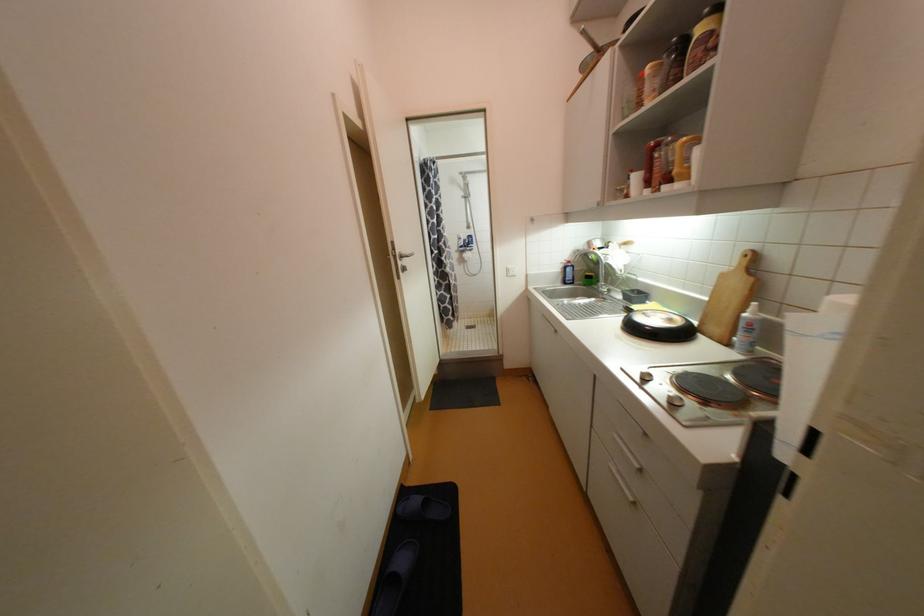
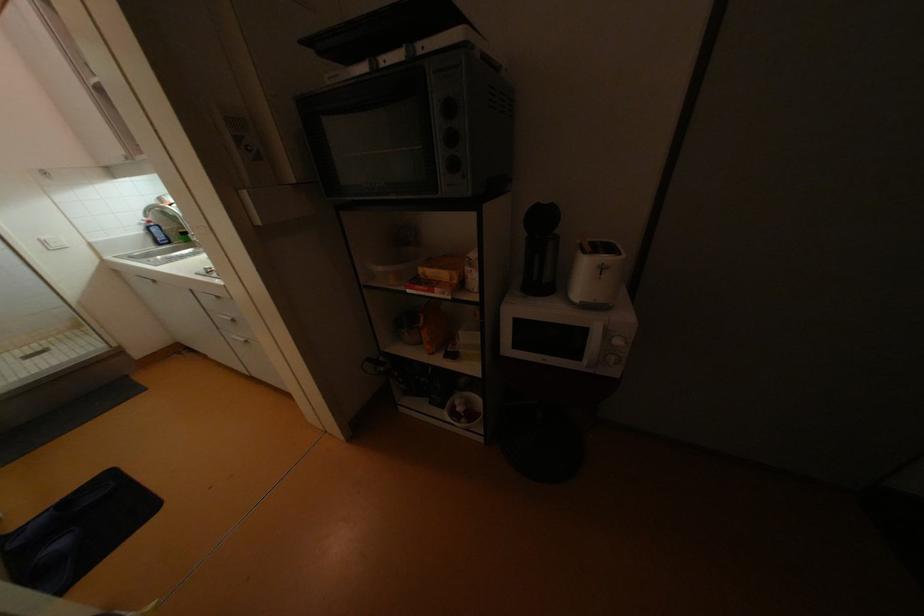
Question: I am providing you with two images of the same scene from different viewpoints. Which of the following objects are not visible in image2?

Choices:
 (A) black oven dial
 (B) blue soap bottle
 (C) wooden cutting board
 (D) red moka pot

Answer: (C)